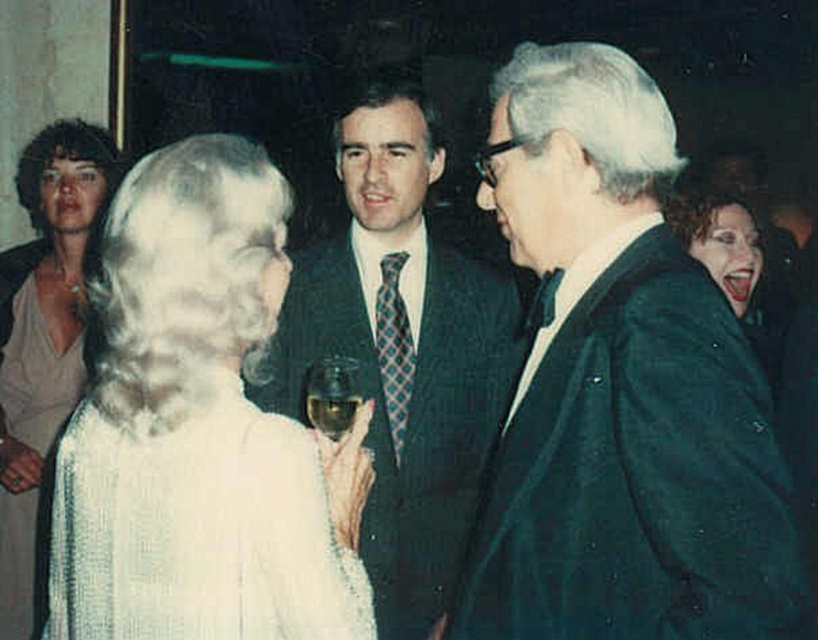
Question: Is dark green textured suit at center further to the viewer compared to translucent glass at center?

Choices:
 (A) yes
 (B) no

Answer: (B)

Question: Estimate the real-world distances between objects in this image. Which object is closer to the dark brown synthetic wig at upper right?

Choices:
 (A) blue plaid tie at center
 (B) matte black wig at center
 (C) white silky wig at upper left
 (D) dark green textured suit at center

Answer: (B)

Question: Among these objects, which one is nearest to the camera?

Choices:
 (A) clear glass wine glass at center
 (B) shiny silver dress at center

Answer: (A)

Question: Among these objects, which one is farthest from the camera?

Choices:
 (A) dark suit at center
 (B) dark brown synthetic wig at upper right
 (C) white sequined dress at center
 (D) dark green textured suit at center

Answer: (B)

Question: Is dark brown hair at upper left to the left of clear glass wine glass at center from the viewer's perspective?

Choices:
 (A) yes
 (B) no

Answer: (A)

Question: Can you confirm if shiny black hair at upper right is thinner than blue plaid tie at center?

Choices:
 (A) yes
 (B) no

Answer: (B)